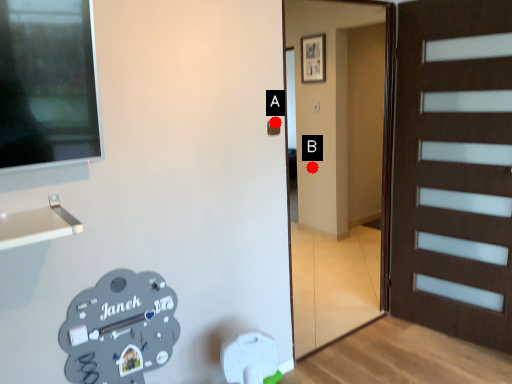
Question: Two points are circled on the image, labeled by A and B beside each circle. Which of the following is the closest to the observer?

Choices:
 (A) A is closer
 (B) B is closer

Answer: (A)